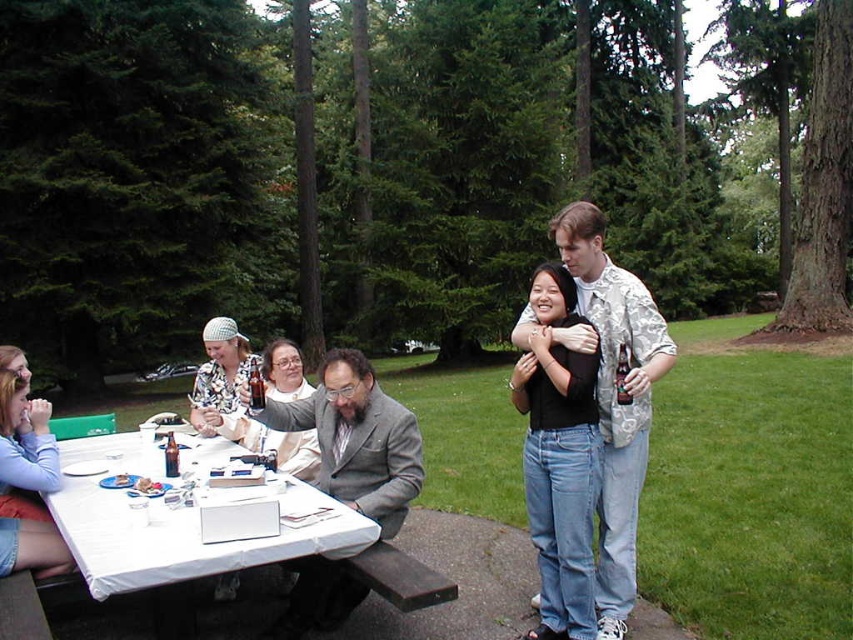
Question: Which object is closer to the camera taking this photo?

Choices:
 (A) white plastic table at lower left
 (B) white floral shirt at upper right
 (C) gray wool suit at center
 (D) matte gray suit at center

Answer: (A)

Question: Can you confirm if white plastic table at lower left is positioned below white floral shirt at upper right?

Choices:
 (A) yes
 (B) no

Answer: (A)

Question: Estimate the real-world distances between objects in this image. Which object is closer to the white plastic table at lower left?

Choices:
 (A) matte gray suit at center
 (B) white floral shirt at upper right
 (C) gray wool suit at center

Answer: (C)

Question: Which point is closer to the camera taking this photo?

Choices:
 (A) (616, 330)
 (B) (392, 408)
 (C) (244, 541)
 (D) (633, 579)

Answer: (C)

Question: Does white floral shirt at upper right have a larger size compared to gray wool suit at center?

Choices:
 (A) no
 (B) yes

Answer: (A)

Question: Is matte gray suit at center positioned before gray wool suit at center?

Choices:
 (A) yes
 (B) no

Answer: (A)